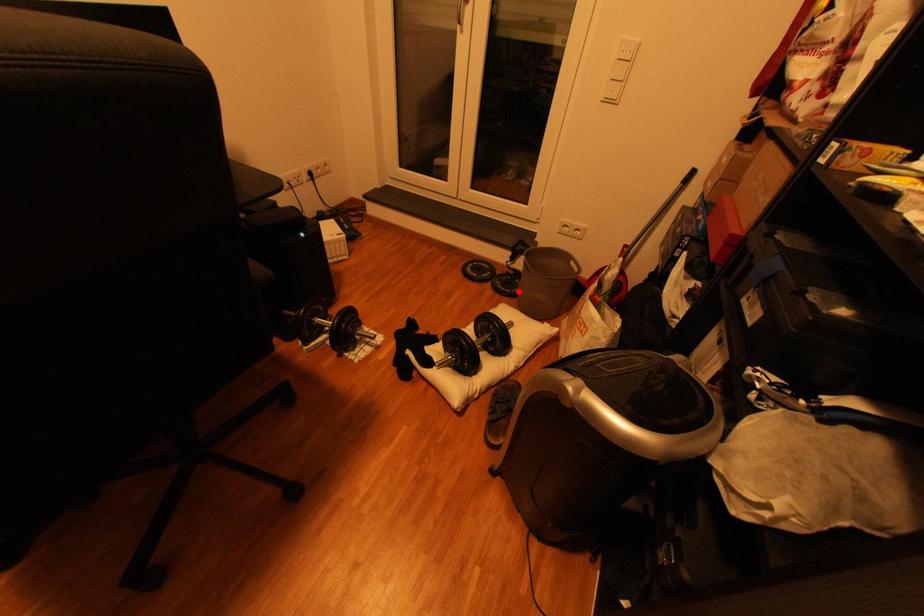
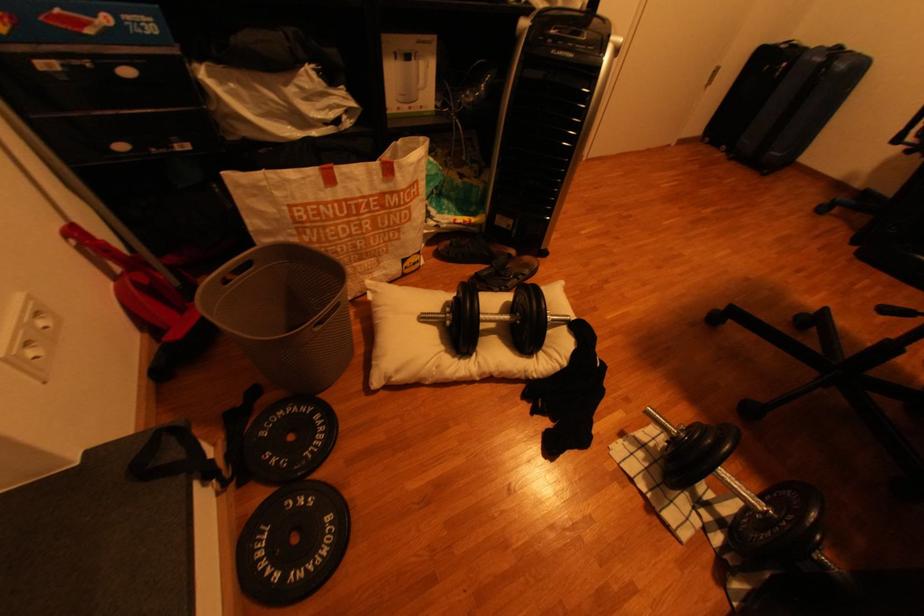
The point at the highlighted location is marked in the first image. Where is the corresponding point in the second image?

(325, 419)